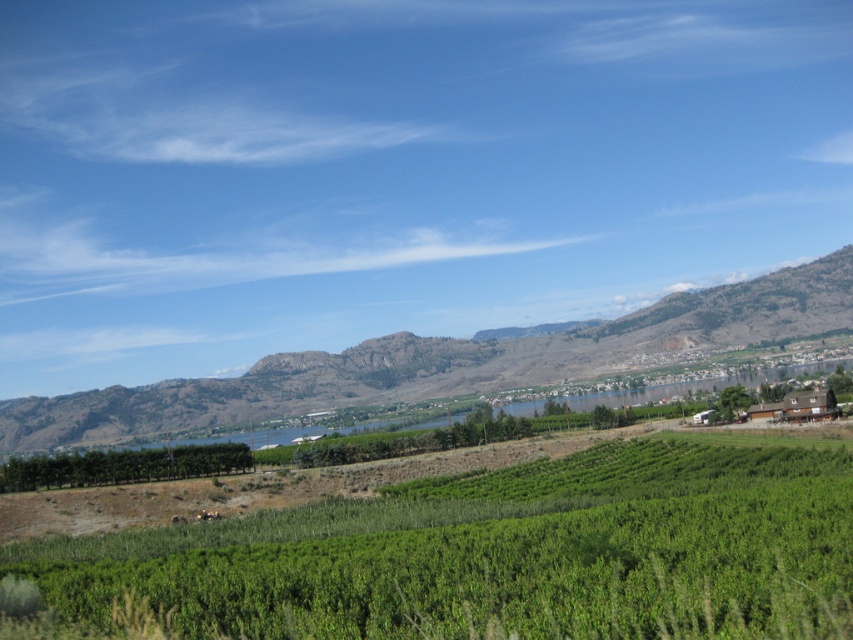
Does green leafy vineyard at center have a greater width compared to green grassy hill at left?

In fact, green leafy vineyard at center might be narrower than green grassy hill at left.

Can you confirm if green leafy vineyard at center is positioned to the right of green grassy hill at left?

Yes, green leafy vineyard at center is to the right of green grassy hill at left.

Between point (708, 538) and point (416, 337), which one is positioned in front?

Point (708, 538) is in front.

The image size is (853, 640). I want to click on green leafy vineyard at center, so click(x=498, y=554).